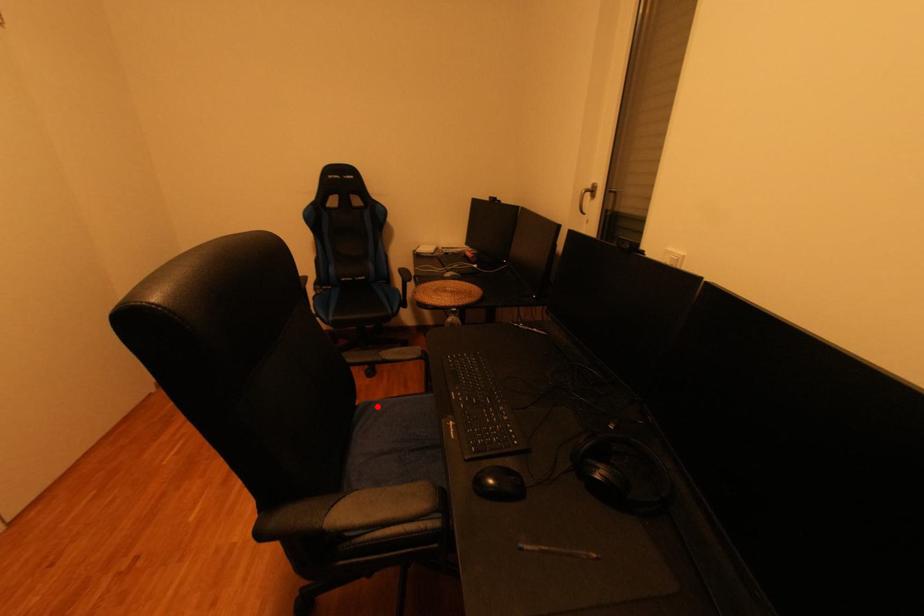
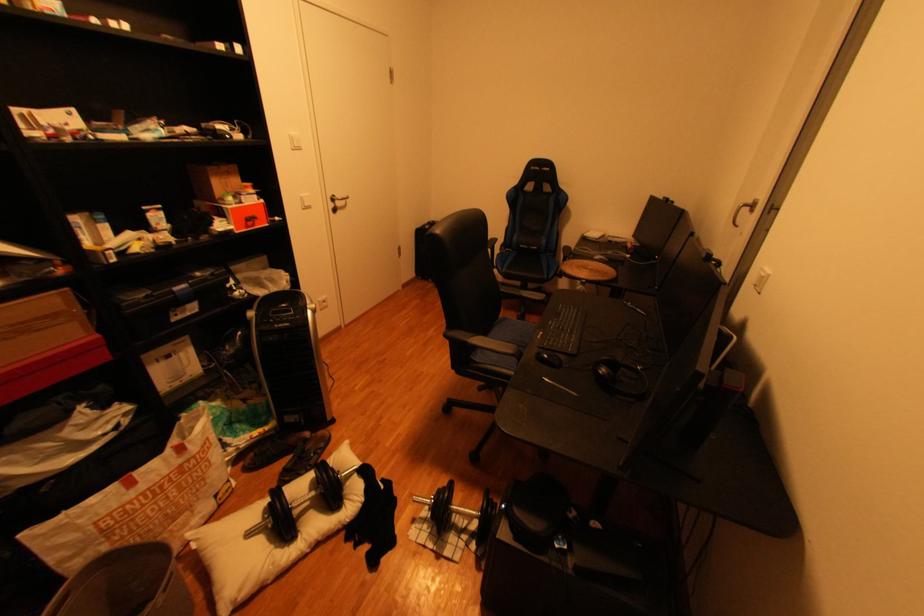
Find the pixel in the second image that matches the highlighted location in the first image.

(515, 320)